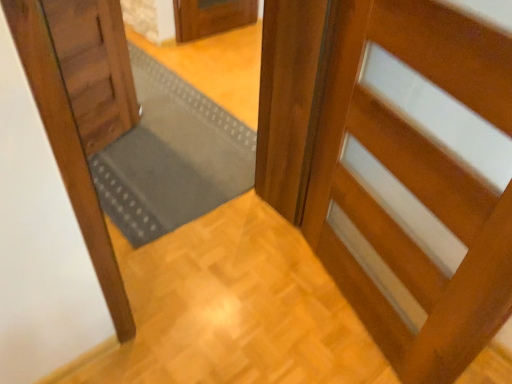
At what (x,y) coordinates should I click in order to perform the action: click on vacant space in front of wooden door at left, placed as the 1th door when sorted from left to right. Please return your answer as a coordinate pair (x, y). Looking at the image, I should click on click(128, 186).